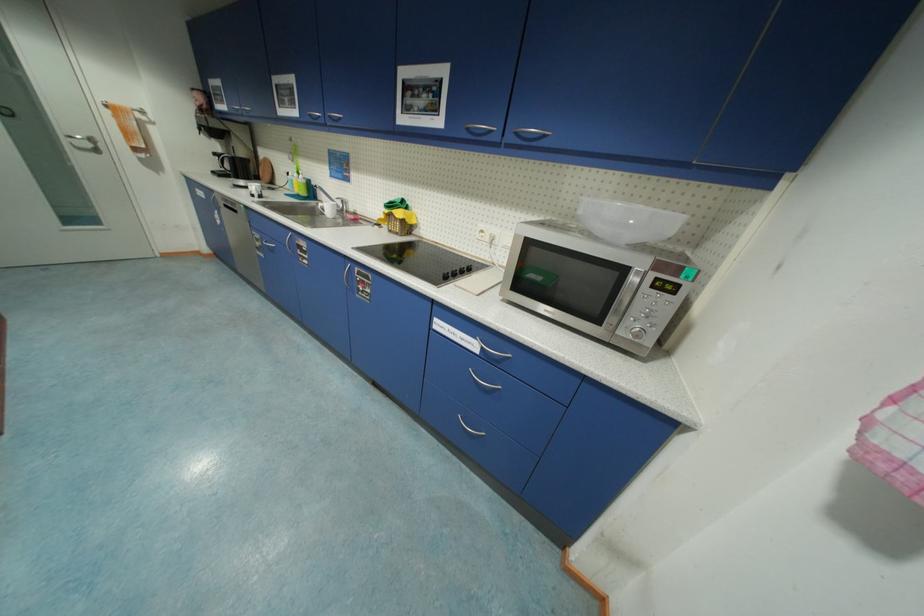
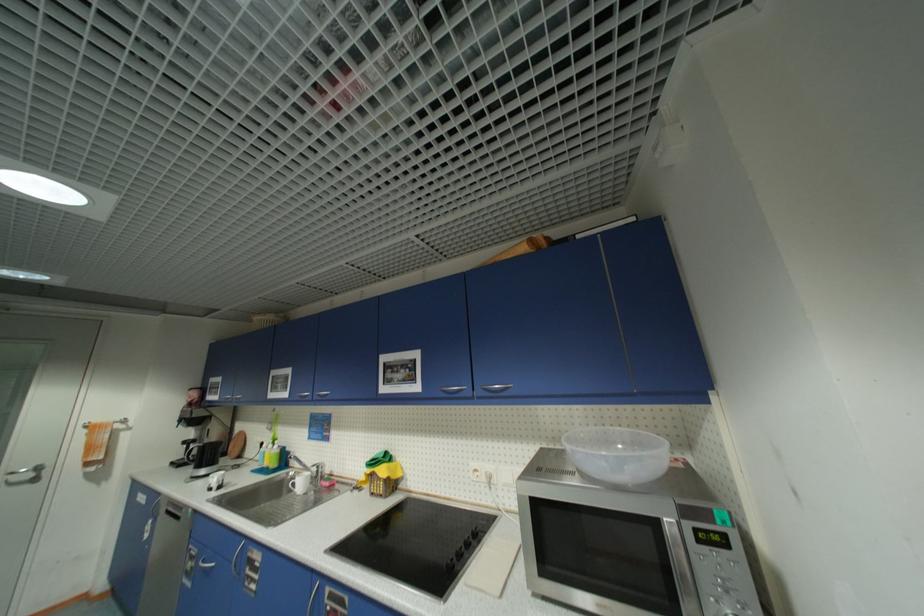
The point at [630,296] is marked in the first image. Where is the corresponding point in the second image?

(682, 556)